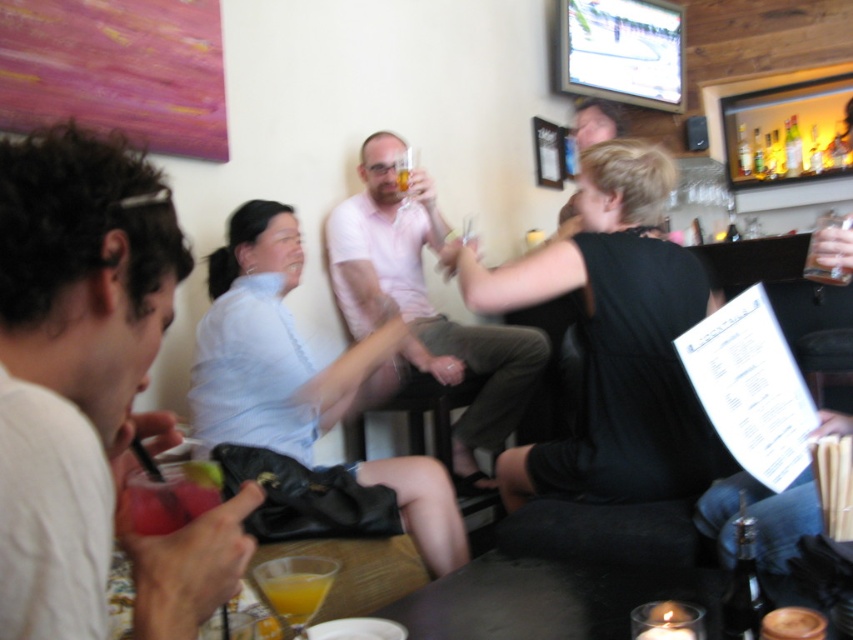
Question: Among these objects, which one is farthest from the camera?

Choices:
 (A) translucent glass at upper center
 (B) pink cotton shirt at center
 (C) translucent glass at lower center

Answer: (A)

Question: Can you confirm if pink cotton shirt at center is smaller than translucent glass at upper center?

Choices:
 (A) yes
 (B) no

Answer: (B)

Question: Which object appears closest to the camera in this image?

Choices:
 (A) white matte shirt at upper left
 (B) pink cotton shirt at center

Answer: (A)

Question: Can you confirm if light blue shirt at center is wider than translucent glass bottles at upper right?

Choices:
 (A) yes
 (B) no

Answer: (A)

Question: Does white matte shirt at upper left lie behind translucent glass bottles at upper right?

Choices:
 (A) no
 (B) yes

Answer: (A)

Question: Considering the real-world distances, which object is farthest from the pink cotton shirt at center?

Choices:
 (A) light blue shirt at center
 (B) white matte shirt at upper left
 (C) translucent glass at lower center
 (D) translucent glass at upper center

Answer: (B)